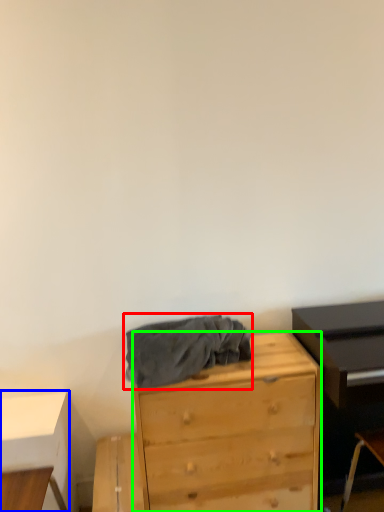
Question: Considering the real-world distances, which object is closest to clothing (highlighted by a red box)? table (highlighted by a blue box) or chest of drawers (highlighted by a green box).

Choices:
 (A) table
 (B) chest of drawers

Answer: (B)